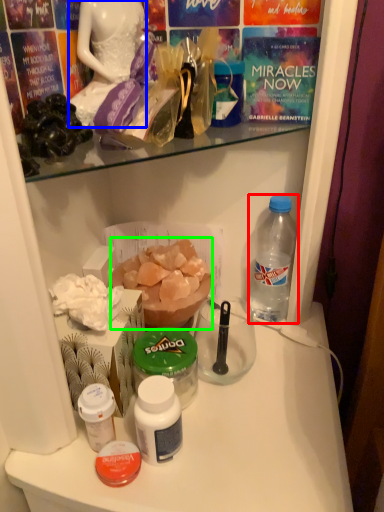
Question: Which is farther away from bottle (highlighted by a red box)? fancy dress (highlighted by a blue box) or food (highlighted by a green box)?

Choices:
 (A) fancy dress
 (B) food

Answer: (A)